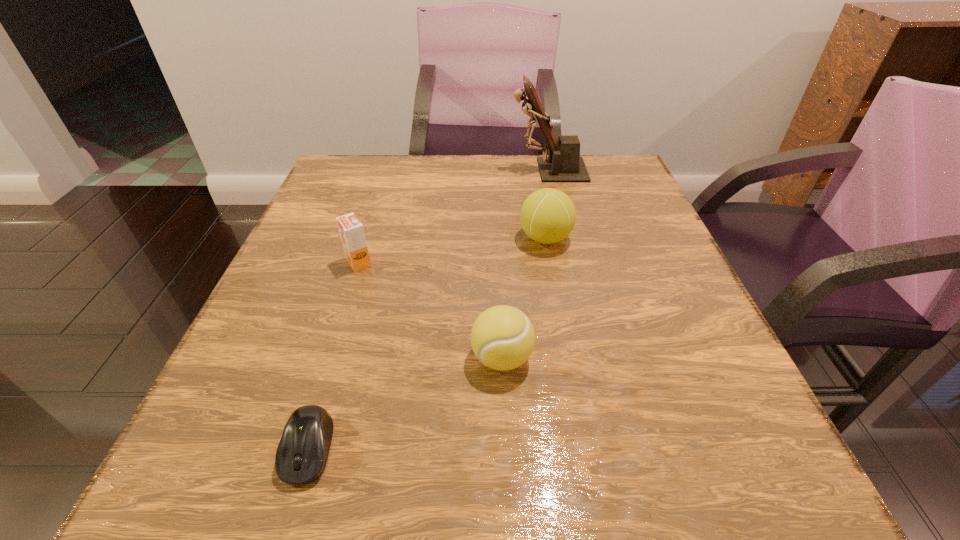
Locate an element on the screen. This screenshot has height=540, width=960. vacant space located on the left of the farther tennis ball is located at coordinates (413, 238).

You are a GUI agent. You are given a task and a screenshot of the screen. Output one action in this format:
    pyautogui.click(x=<x>, y=<y>)
    Task: Click on the vacant space located 0.070m on the back of the orange juice
    Image resolution: width=960 pixels, height=540 pixels.
    Given the screenshot: What is the action you would take?
    pyautogui.click(x=368, y=232)

The height and width of the screenshot is (540, 960). I want to click on vacant space located 0.180m on the back of the second nearest object, so click(497, 264).

Where is `vacant area located on the left of the shortest object`? Image resolution: width=960 pixels, height=540 pixels. vacant area located on the left of the shortest object is located at coordinates (208, 449).

Where is `object positioned at the far edge`? Image resolution: width=960 pixels, height=540 pixels. object positioned at the far edge is located at coordinates (563, 164).

At what (x,y) coordinates should I click in order to perform the action: click on object located at the near edge. Please return your answer as a coordinate pair (x, y). Looking at the image, I should click on (303, 449).

Where is `orange juice located at the left edge`? This screenshot has height=540, width=960. orange juice located at the left edge is located at coordinates (351, 230).

The image size is (960, 540). I want to click on mouse that is positioned at the left edge, so click(x=303, y=449).

This screenshot has height=540, width=960. I want to click on object located at the right edge, so click(x=563, y=164).

Find the location of `object that is at the near left corner`. object that is at the near left corner is located at coordinates (303, 449).